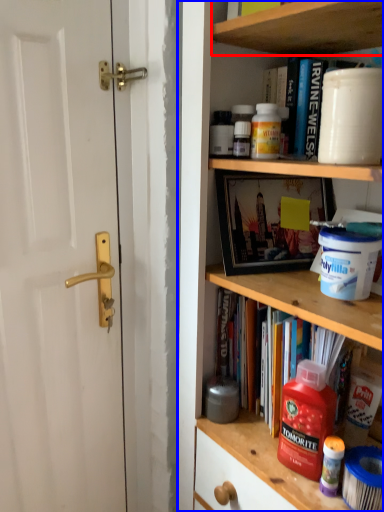
Question: Which of the following is the closest to the observer, cabinet (highlighted by a red box) or shelf (highlighted by a blue box)?

Choices:
 (A) cabinet
 (B) shelf

Answer: (B)